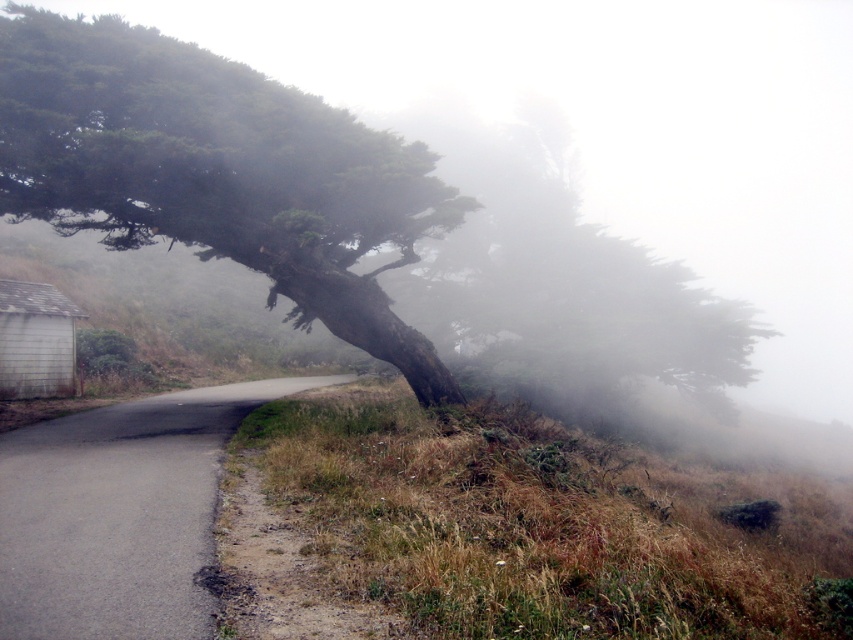
In the scene shown: Is green rough bark tree at upper left shorter than asphalt road at lower left?

No.

Can you confirm if green rough bark tree at upper left is wider than asphalt road at lower left?

Correct, the width of green rough bark tree at upper left exceeds that of asphalt road at lower left.

Is point (270, 237) closer to camera compared to point (189, 445)?

No, (270, 237) is further to viewer.

You are a GUI agent. You are given a task and a screenshot of the screen. Output one action in this format:
    pyautogui.click(x=<x>, y=<y>)
    Task: Click on the green rough bark tree at upper left
    
    Given the screenshot: What is the action you would take?
    pyautogui.click(x=218, y=172)

Can you confirm if dry grass at lower right is positioned to the right of green rough bark tree at upper left?

Correct, you'll find dry grass at lower right to the right of green rough bark tree at upper left.

Does dry grass at lower right have a greater height compared to green rough bark tree at upper left?

No, dry grass at lower right is not taller than green rough bark tree at upper left.

This screenshot has width=853, height=640. Describe the element at coordinates (538, 524) in the screenshot. I see `dry grass at lower right` at that location.

The image size is (853, 640). Find the location of `dry grass at lower right`. dry grass at lower right is located at coordinates (538, 524).

Is point (323, 404) less distant than point (4, 563)?

No, (323, 404) is behind (4, 563).

Image resolution: width=853 pixels, height=640 pixels. Identify the location of dry grass at lower right. (538, 524).

The image size is (853, 640). What are the coordinates of `dry grass at lower right` in the screenshot? It's located at (538, 524).